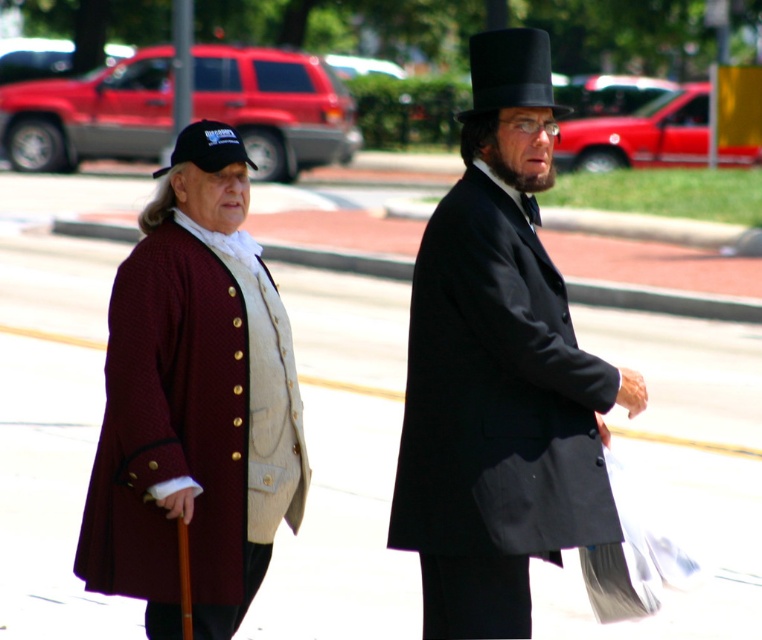
Looking at this image, you are a photographer standing at the center of the scene. You want to focus your camera on both point (x=469, y=80) and point (x=175, y=160). Which point should you focus on first to ensure both are in focus?

You should focus on point (x=469, y=80) first because it is closer to the camera than point (x=175, y=160), ensuring both points will be in focus when using proper depth of field.

You are a photographer trying to capture a clear shot of both the matte black coat at center and the black felt top hat at upper center in the image. Based on their positions, which object should you focus on first to ensure both are in frame?

The matte black coat at center is located below the black felt top hat at upper center. To ensure both are in frame, focus on the black felt top hat at upper center first, as it is higher up, then adjust the camera angle downward to include the matte black coat at center.